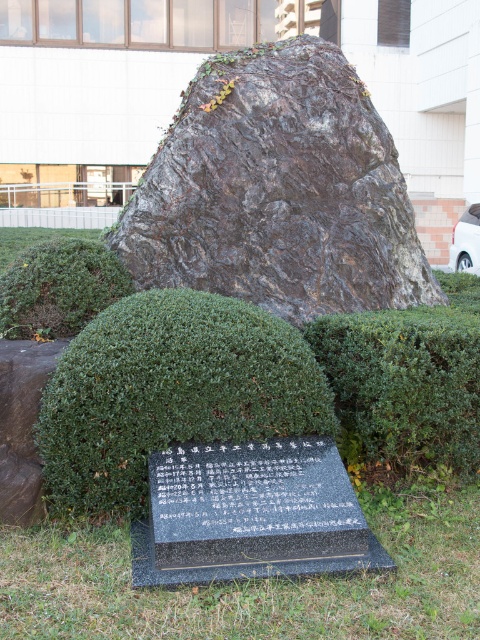
You are standing at the base of the large dark boulder and want to walk to the modern building in the background. There are two green leafy hedges in your path. The first is the green leafy hedge at center and the second is the green leafy hedge at lower left. Which hedge should you go around to reach the building more quickly?

The green leafy hedge at center is closer to you than the green leafy hedge at lower left, so you should go around the green leafy hedge at center first to reach the building more quickly.

You are standing at the base of the boulder and want to walk towards the modern building in the background. Which point, point (131, 312) or point (477, 396), should you aim for to ensure you are moving towards the building?

You should aim for point (477, 396) because it is behind point (131, 312), meaning it is closer to the modern building in the background.

You are a landscape architect designing a garden pathway. You need to place a 3m wide statue between the dark brown rock at center and the green shrubbery at center. Can you fit it there?

The dark brown rock at center is larger in size than green shrubbery at center. However, the exact distance between them isn